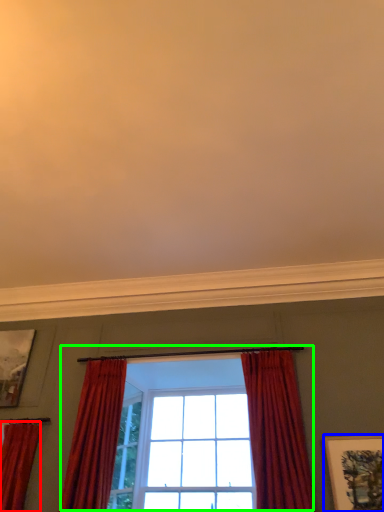
Question: Considering the real-world distances, which object is farthest from curtain (highlighted by a red box)? picture frame (highlighted by a blue box) or window (highlighted by a green box)?

Choices:
 (A) picture frame
 (B) window

Answer: (A)